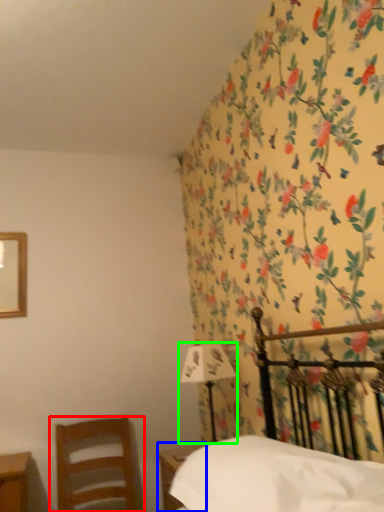
Question: Based on their relative distances, which object is farther from chair (highlighted by a red box)? Choose from nightstand (highlighted by a blue box) and bedside lamp (highlighted by a green box).

Choices:
 (A) nightstand
 (B) bedside lamp

Answer: (B)